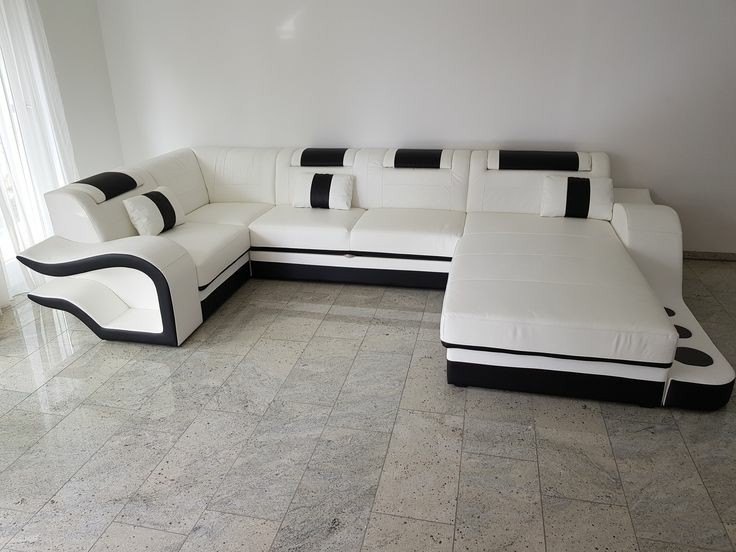
The image size is (736, 552). I want to click on wall, so click(x=438, y=47).